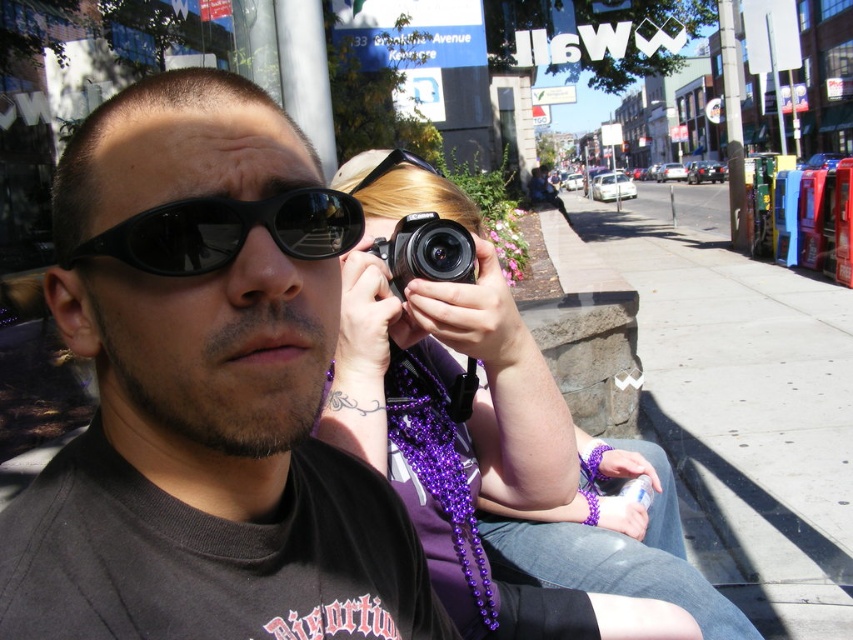
Between point (74, 204) and point (454, 275), which one is positioned in front?

Positioned in front is point (74, 204).

Does matte black sunglasses at center have a smaller size compared to black plastic camera at center?

No.

Find the location of a particular element. Image resolution: width=853 pixels, height=640 pixels. matte black sunglasses at center is located at coordinates (204, 394).

You are a GUI agent. You are given a task and a screenshot of the screen. Output one action in this format:
    pyautogui.click(x=<x>, y=<y>)
    Task: Click on the matte black sunglasses at center
    This screenshot has width=853, height=640.
    Given the screenshot: What is the action you would take?
    pyautogui.click(x=204, y=394)

Is point (660, 561) in front of point (416, 268)?

No, it is not.

Measure the distance between point (x=479, y=580) and camera.

They are 4.80 feet apart.

Locate an element on the screen. Image resolution: width=853 pixels, height=640 pixels. purple beaded necklace at center is located at coordinates click(492, 435).

Between purple beaded necklace at center and black reflective sunglasses at center, which one has more height?

Standing taller between the two is purple beaded necklace at center.

Does point (496, 387) come in front of point (242, 212)?

That is False.

What are the coordinates of `purple beaded necklace at center` in the screenshot? It's located at (492, 435).